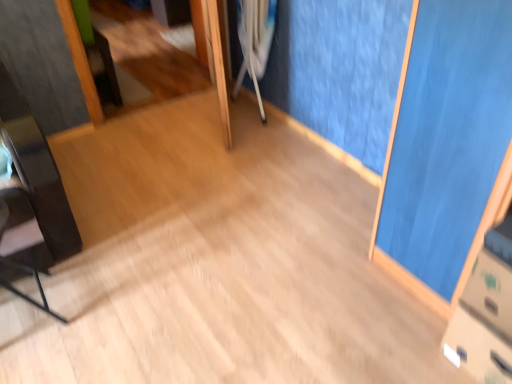
I want to click on vacant space in front of matte black chair at left, so click(35, 363).